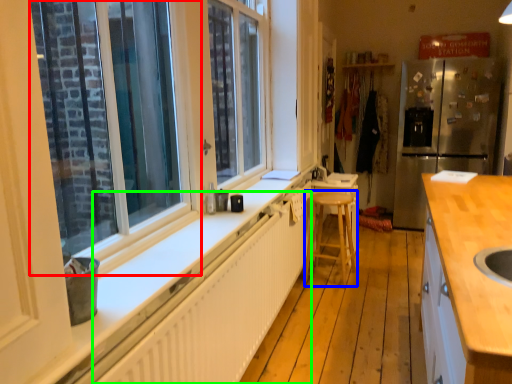
Question: Estimate the real-world distances between objects in this image. Which object is closer to window (highlighted by a red box), bar stool (highlighted by a blue box) or radiator (highlighted by a green box)?

Choices:
 (A) bar stool
 (B) radiator

Answer: (B)